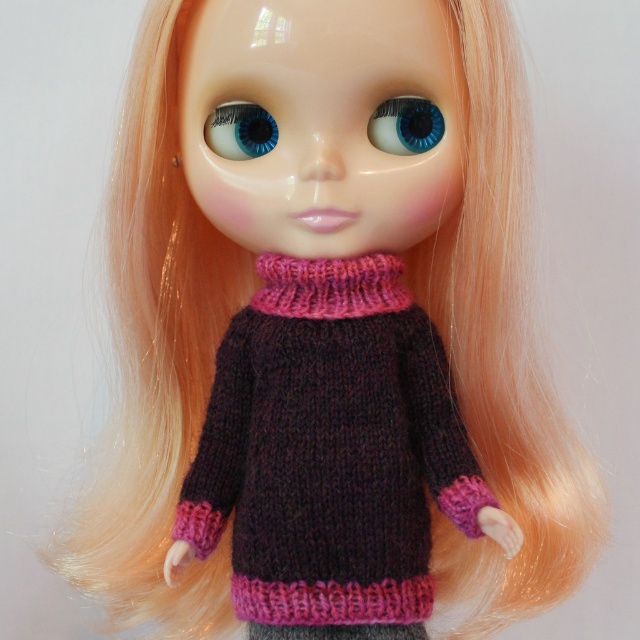
Question: Where is knitted dark purple sweater at center located in relation to blue glossy eye at upper center in the image?

Choices:
 (A) left
 (B) right

Answer: (B)

Question: Which object is positioned farthest from the knitted dark purple sweater at center?

Choices:
 (A) blue glossy eye at upper center
 (B) blue glossy eye at center

Answer: (A)

Question: Is knitted dark purple sweater at center positioned before blue glossy eye at upper center?

Choices:
 (A) no
 (B) yes

Answer: (B)

Question: Among these points, which one is farthest from the camera?

Choices:
 (A) (401, 152)
 (B) (243, 112)

Answer: (B)

Question: Which point is farther to the camera?

Choices:
 (A) (432, 118)
 (B) (371, 380)

Answer: (B)

Question: Is blue glossy eye at center to the left of blue glossy eye at upper center from the viewer's perspective?

Choices:
 (A) no
 (B) yes

Answer: (A)